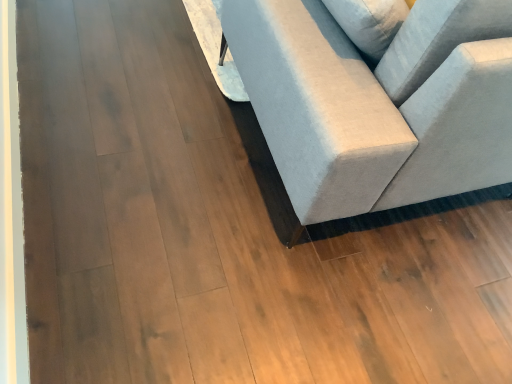
Measure the distance between light gray fabric couch at lower right and camera.

light gray fabric couch at lower right is 31.29 inches from camera.

What do you see at coordinates (373, 109) in the screenshot? I see `light gray fabric couch at lower right` at bounding box center [373, 109].

The width and height of the screenshot is (512, 384). I want to click on light gray fabric couch at lower right, so click(x=373, y=109).

At what (x,y) coordinates should I click in order to perform the action: click on light gray fabric couch at lower right. Please return your answer as a coordinate pair (x, y). The width and height of the screenshot is (512, 384). Looking at the image, I should click on tap(373, 109).